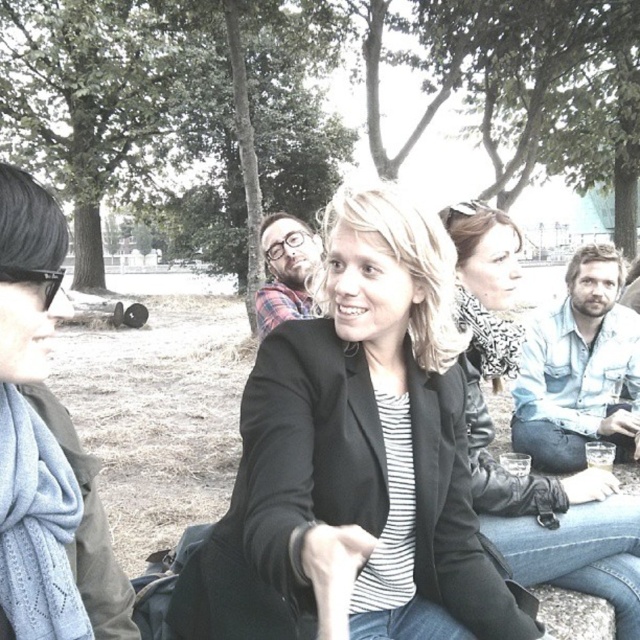
You are planning to wear a scarf for a casual gathering. You have two options in your bag. The light blue scarf at center and the light blue knitted scarf at left. Which one would you choose if you want a wider scarf?

The light blue scarf at center has a larger width than the light blue knitted scarf at left, so you should choose the light blue scarf at center for a wider option.

You are organizing a charity event and need to determine if the black matte blazer at center can be displayed in a showcase designed for items no larger than the light blue knitted scarf at left. Based on the scene description, will it fit?

The black matte blazer at center is larger in size than the light blue knitted scarf at left, so it will not fit in the showcase designed for items no larger than the scarf.

You are standing at the origin of the coordinate system in the image. You want to place a picnic basket at point (355, 458). Is there enough space to place the basket there?

The point (355, 458) is occupied by the black matte blazer at center, so there is no space to place the picnic basket there.